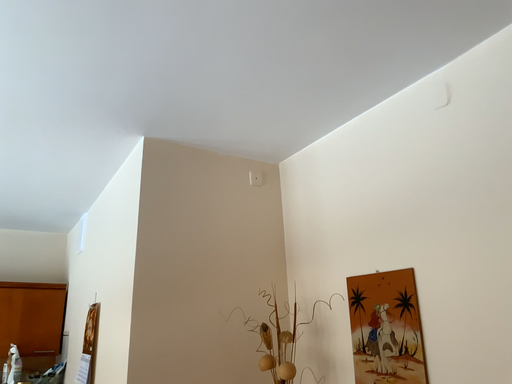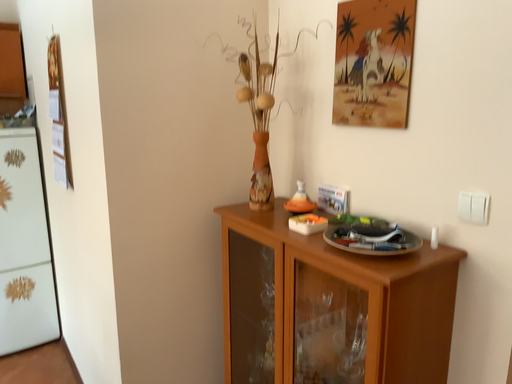
Question: Which way did the camera rotate in the video?

Choices:
 (A) rotated upward
 (B) rotated downward

Answer: (B)